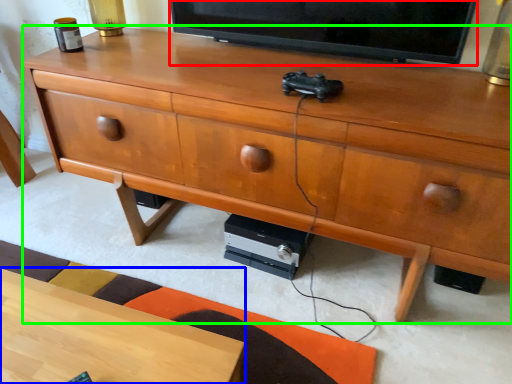
Question: Which is nearer to the television (highlighted by a red box)? desk (highlighted by a blue box) or chest of drawers (highlighted by a green box).

Choices:
 (A) desk
 (B) chest of drawers

Answer: (B)